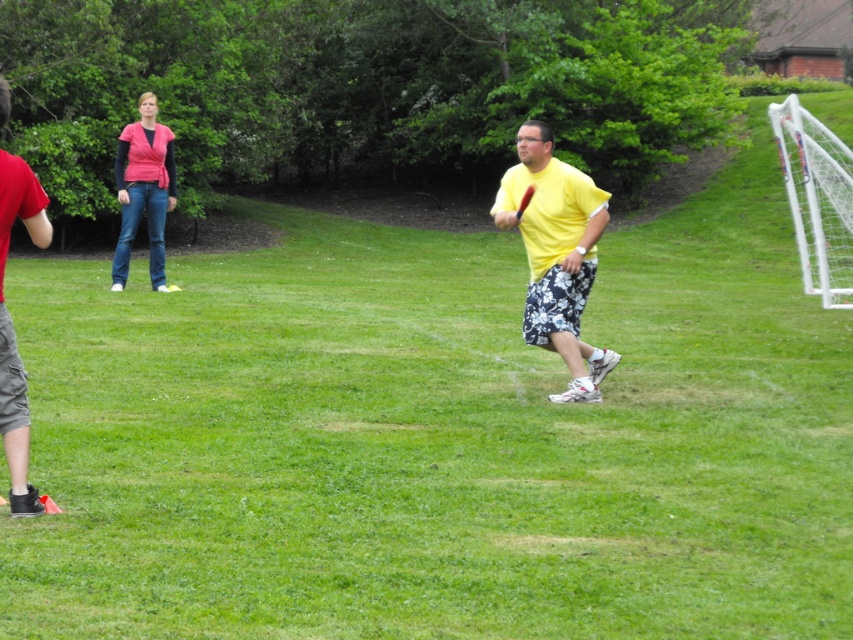
You are a photographer standing at the center of the field. You want to take a photo of the red cotton shirt at left and the matte pink shirt at upper left. Which shirt should you focus on first if you want to capture both in the frame without moving the camera?

The red cotton shirt at left is shorter than the matte pink shirt at upper left, so you should focus on the red cotton shirt at left first to ensure both are in the frame.

You are a photographer trying to capture the exact location of the yellow matte shirt at center in the image. According to the coordinates provided, where would you focus your camera lens to ensure the shirt is centered in the frame?

To center the yellow matte shirt at center in the frame, focus your camera lens at the coordinates point (556, 253).

You are a photographer standing in the center of the field. You want to take a photo of the red cotton shirt at left and the matte pink shirt at upper left. Which shirt is positioned more to the left side of the frame?

The matte pink shirt at upper left is positioned more to the left side of the frame because the red cotton shirt at left is to the right of it.